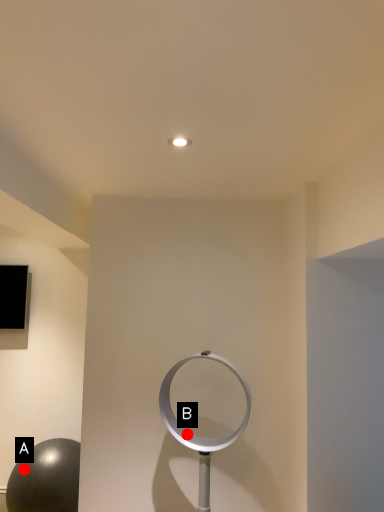
Question: Two points are circled on the image, labeled by A and B beside each circle. Which point appears farthest from the camera in this image?

Choices:
 (A) A is further
 (B) B is further

Answer: (A)